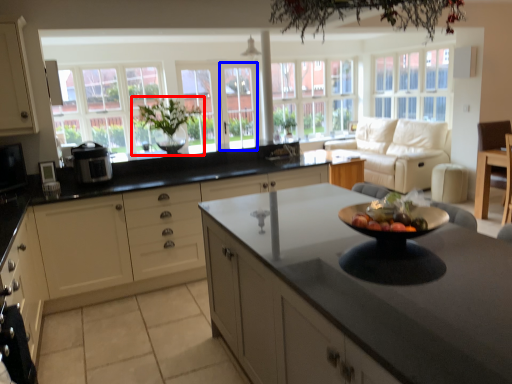
Question: Which of the following is the closest to the observer, houseplant (highlighted by a red box) or glass door (highlighted by a blue box)?

Choices:
 (A) houseplant
 (B) glass door

Answer: (A)